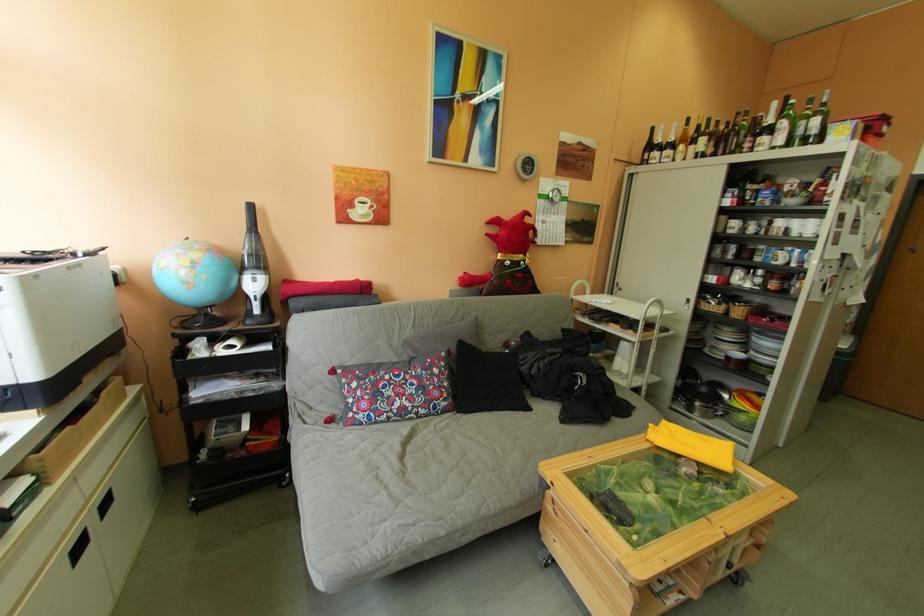
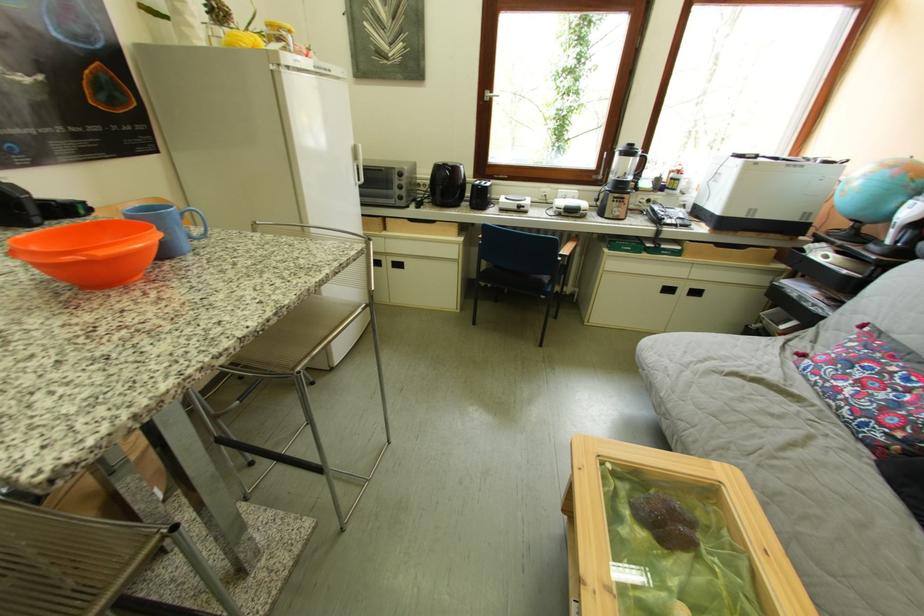
Locate, in the second image, the point that corresponds to [395,405] in the first image.

(849, 374)